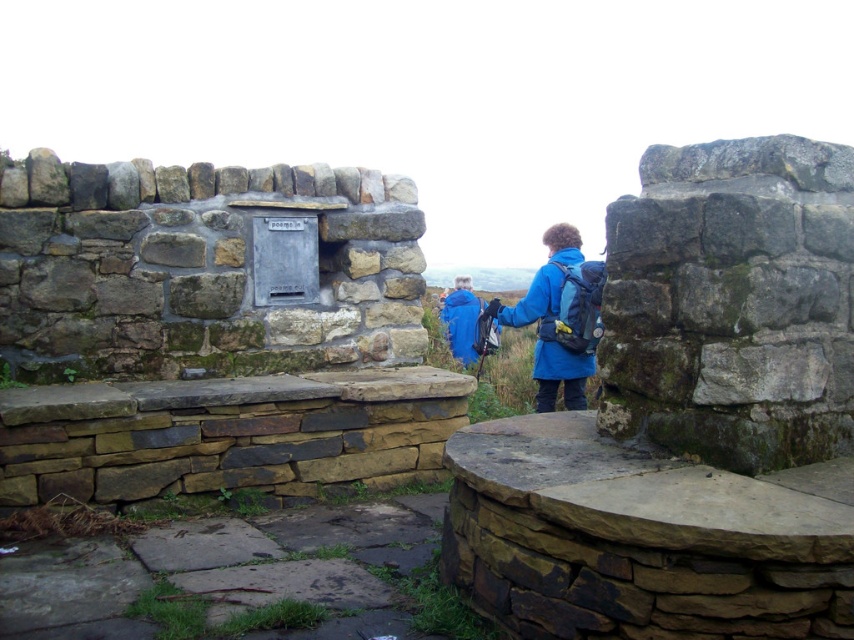
Between point (510, 317) and point (468, 356), which one is positioned behind?

Positioned behind is point (468, 356).

Does blue fabric jacket at center have a smaller size compared to blue synthetic jacket at center?

Yes.

Find the location of a particular element. Image resolution: width=854 pixels, height=640 pixels. blue fabric jacket at center is located at coordinates (534, 298).